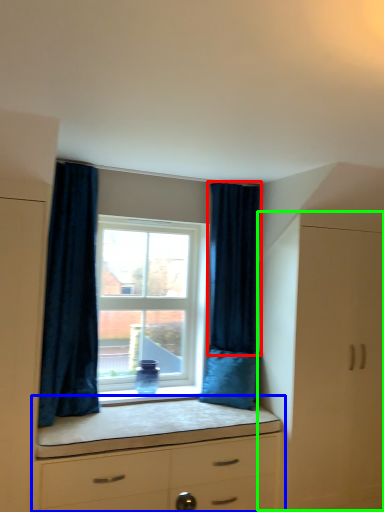
Question: Which is nearer to the curtain (highlighted by a red box)? chest of drawers (highlighted by a blue box) or file cabinet (highlighted by a green box).

Choices:
 (A) chest of drawers
 (B) file cabinet

Answer: (B)